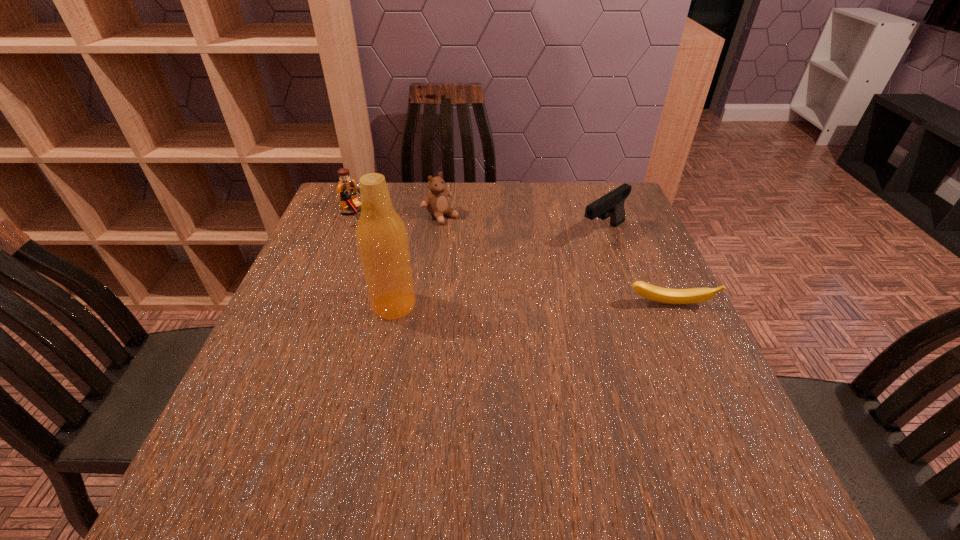
Locate an element on the screen. beer bottle is located at coordinates (381, 236).

You are a GUI agent. You are given a task and a screenshot of the screen. Output one action in this format:
    pyautogui.click(x=<x>, y=<y>)
    Task: Click on the banana
    
    Given the screenshot: What is the action you would take?
    pyautogui.click(x=654, y=293)

Where is `teddy bear`? This screenshot has width=960, height=540. teddy bear is located at coordinates (436, 203).

You are a GUI agent. You are given a task and a screenshot of the screen. Output one action in this format:
    pyautogui.click(x=<x>, y=<y>)
    Task: Click on the leftmost object
    This screenshot has width=960, height=540.
    Given the screenshot: What is the action you would take?
    pyautogui.click(x=346, y=189)

Identify the location of pistol. (611, 205).

This screenshot has height=540, width=960. Identify the location of free location located on the left of the tallest object. (313, 305).

Identify the location of vacant space located 0.070m at the stem of the shortest object. This screenshot has height=540, width=960. (684, 335).

Locate an element on the screen. free space located on the front-facing side of the teddy bear is located at coordinates 485,247.

Locate an element on the screen. free space located on the front-facing side of the teddy bear is located at coordinates (503, 260).

Where is `vacant region located 0.130m on the front-facing side of the teddy bear`? The image size is (960, 540). vacant region located 0.130m on the front-facing side of the teddy bear is located at coordinates (482, 245).